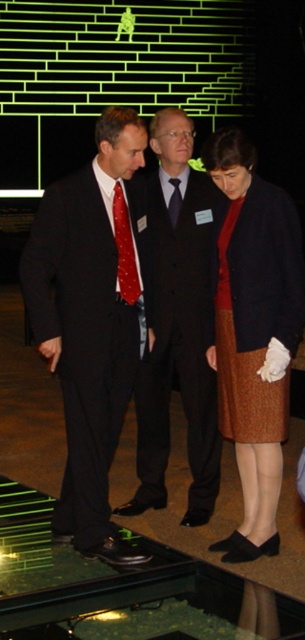
Which is behind, point (126, 225) or point (169, 202)?

Point (169, 202)

Can you confirm if red dotted fabric tie at center is thinner than black silk tie at center?

No, red dotted fabric tie at center is not thinner than black silk tie at center.

Is point (124, 224) farther from viewer compared to point (176, 182)?

No, it is not.

I want to click on red dotted fabric tie at center, so click(125, 250).

Consider the image. Does brown textured skirt at right appear under shiny black suit at center?

Correct, brown textured skirt at right is located below shiny black suit at center.

Which is behind, point (301, 321) or point (157, 476)?

The point (157, 476) is behind.

Locate an element on the screen. The width and height of the screenshot is (305, 640). brown textured skirt at right is located at coordinates (254, 332).

Does brown textured skirt at right have a larger size compared to red dotted fabric tie at center?

Correct, brown textured skirt at right is larger in size than red dotted fabric tie at center.

Looking at this image, can you confirm if brown textured skirt at right is positioned to the right of red dotted fabric tie at center?

Indeed, brown textured skirt at right is positioned on the right side of red dotted fabric tie at center.

Identify the location of brown textured skirt at right. (254, 332).